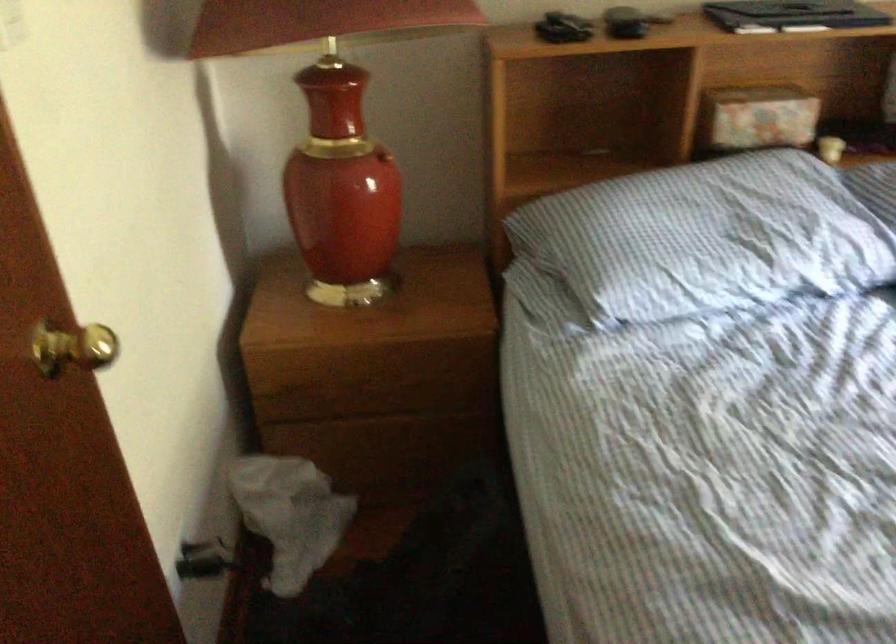
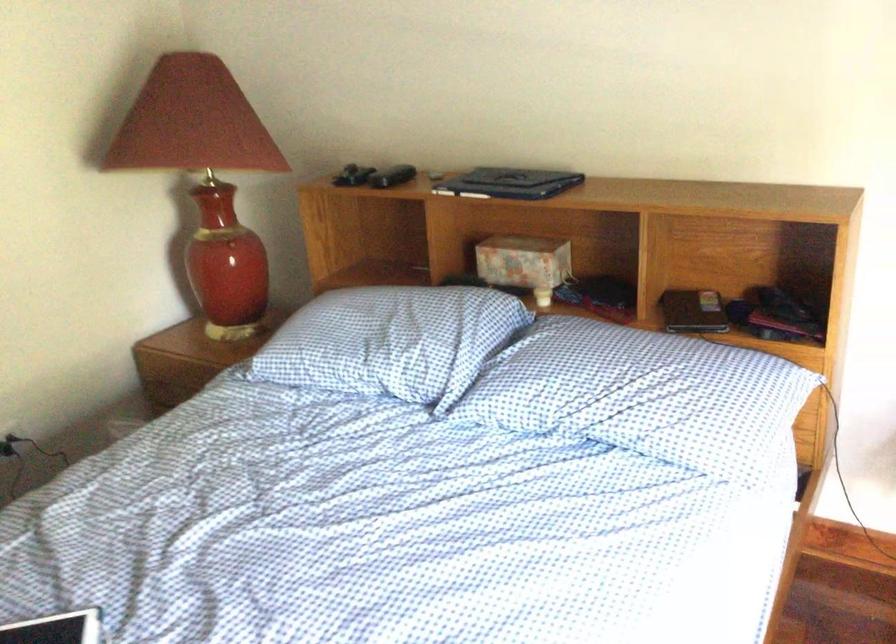
Question: I am providing you with two images of the same scene from different viewpoints. After the viewpoint changes to image2, which objects are now occluded?

Choices:
 (A) closed laptop
 (B) black game controller
 (C) white plastic bag
 (D) long metal pole

Answer: (C)